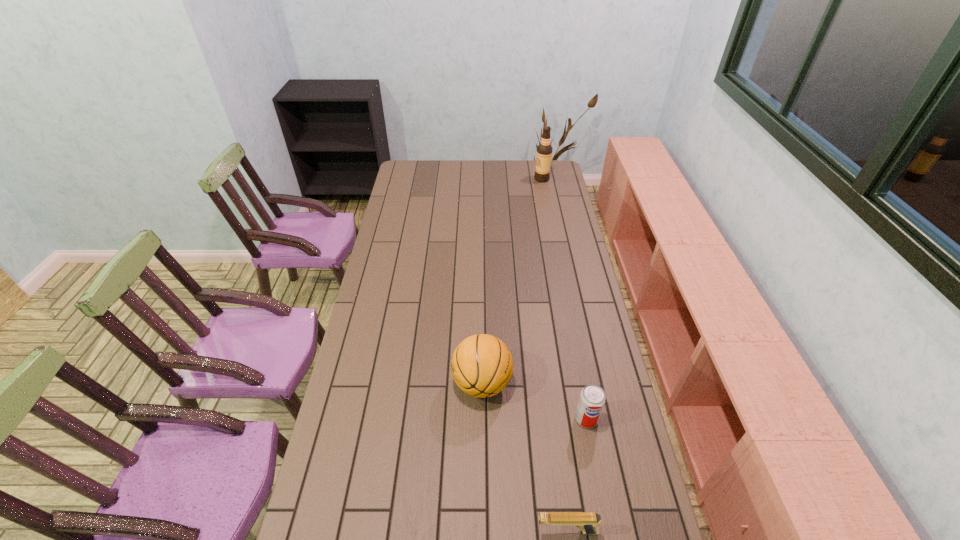
Identify the location of free location located on the surface of the leftmost object near the brand logo. (372, 383).

You are a GUI agent. You are given a task and a screenshot of the screen. Output one action in this format:
    pyautogui.click(x=<x>, y=<y>)
    Task: Click on the vacant space located on the surface of the leftmost object near the brand logo
    Image resolution: width=960 pixels, height=540 pixels.
    Given the screenshot: What is the action you would take?
    pyautogui.click(x=369, y=383)

The width and height of the screenshot is (960, 540). What are the coordinates of `vacant area situated 0.250m on the surface of the leftmost object near the brand logo` in the screenshot? It's located at (378, 383).

What are the coordinates of `free space located 0.230m on the front of the second shortest object` in the screenshot? It's located at (604, 509).

At what (x,y) coordinates should I click in order to perform the action: click on free space located at the barrel of the nearest object. Please return your answer as a coordinate pair (x, y). The height and width of the screenshot is (540, 960). Looking at the image, I should click on (391, 531).

Where is `vacant region located 0.120m at the barrel of the nearest object`? vacant region located 0.120m at the barrel of the nearest object is located at coordinates (490, 531).

The height and width of the screenshot is (540, 960). Identify the location of free space located at the barrel of the nearest object. (448, 531).

Identify the location of object at the far edge. (544, 150).

Find the location of a particular element. This screenshot has height=540, width=960. alcohol at the right edge is located at coordinates (544, 150).

I want to click on soda that is at the right edge, so click(592, 399).